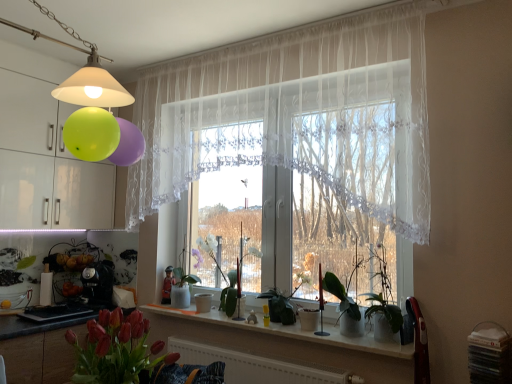
Locate an element on the screen. Image resolution: width=512 pixels, height=384 pixels. white sheer curtain at center is located at coordinates (301, 115).

Describe the element at coordinates (223, 277) in the screenshot. The height and width of the screenshot is (384, 512). I see `white glossy vase at center, acting as the third plant starting from the front` at that location.

The image size is (512, 384). Describe the element at coordinates (384, 305) in the screenshot. I see `green matte plant at center, marked as the 3th plant in a left-to-right arrangement` at that location.

The width and height of the screenshot is (512, 384). I want to click on white sheer curtain at center, so click(x=301, y=115).

Considering the relative positions of matte white lampshade at upper left and green matte plant at center, the 1th plant viewed from the front, in the image provided, is matte white lampshade at upper left in front of green matte plant at center, the 1th plant viewed from the front,?

Yes, it is.

Is matte white lampshade at upper left turned away from green matte plant at center, placed as the 1th plant when sorted from right to left?

matte white lampshade at upper left is not turned away from green matte plant at center, placed as the 1th plant when sorted from right to left.

Between point (92, 101) and point (384, 290), which one is positioned in front?

Positioned in front is point (92, 101).

Is white sheer curtain at center far from white matte radiator at lower center?

Yes, white sheer curtain at center and white matte radiator at lower center are located far from each other.

Is white matte radiator at lower center inside white sheer curtain at center?

Actually, white matte radiator at lower center is outside white sheer curtain at center.

Considering the relative sizes of white sheer curtain at center and white matte radiator at lower center in the image provided, is white sheer curtain at center bigger than white matte radiator at lower center?

Correct, white sheer curtain at center is larger in size than white matte radiator at lower center.

From a real-world perspective, between white sheer curtain at center and white matte radiator at lower center, who is vertically higher?

white sheer curtain at center.

Considering the relative positions of matte white lampshade at upper left and white lace curtain at center in the image provided, is matte white lampshade at upper left behind white lace curtain at center?

No, matte white lampshade at upper left is closer to the camera.

Between matte white lampshade at upper left and white lace curtain at center, which one has larger width?

matte white lampshade at upper left.

From a real-world perspective, is matte white lampshade at upper left under white lace curtain at center?

No, from a real-world perspective, matte white lampshade at upper left is not under white lace curtain at center.

Who is taller, matte white lampshade at upper left or white lace curtain at center?

white lace curtain at center.

How many degrees apart are the facing directions of white matte radiator at lower center and white glossy vase at center, the 1th plant when ordered from left to right?

white matte radiator at lower center and white glossy vase at center, the 1th plant when ordered from left to right, are facing 0.869 degrees away from each other.

Is white matte radiator at lower center bigger than white glossy vase at center, the 1th plant when ordered from left to right?

Actually, white matte radiator at lower center might be smaller than white glossy vase at center, the 1th plant when ordered from left to right.

Would you consider white matte radiator at lower center to be distant from white glossy vase at center, which is counted as the 1th plant, starting from the back?

They are positioned close to each other.

Is white matte radiator at lower center oriented away from white glossy vase at center, which is the 3th plant in right-to-left order?

That's not correct — white matte radiator at lower center is not looking away from white glossy vase at center, which is the 3th plant in right-to-left order.

From a real-world perspective, relative to white lace curtain at center, is white matte radiator at lower center vertically above or below?

white matte radiator at lower center is situated lower than white lace curtain at center in the real world.

Considering the positions of objects white matte radiator at lower center and white lace curtain at center in the image provided, who is in front, white matte radiator at lower center or white lace curtain at center?

white matte radiator at lower center is more forward.

Between white matte radiator at lower center and white lace curtain at center, which one has larger size?

white lace curtain at center.

Is white matte radiator at lower center wider or thinner than white lace curtain at center?

Considering their sizes, white matte radiator at lower center looks slimmer than white lace curtain at center.

This screenshot has height=384, width=512. I want to click on curtain to the left of green matte plant at center, the second plant from the front, so [x=301, y=115].

Which is behind, point (330, 274) or point (285, 113)?

Positioned behind is point (285, 113).

Is green matte plant at center, the second plant positioned from the back, oriented away from white sheer curtain at center?

No, green matte plant at center, the second plant positioned from the back, is not facing away from white sheer curtain at center.

Is green matte plant at center, marked as the 2th plant in a left-to-right arrangement, to the left of white sheer curtain at center from the viewer's perspective?

In fact, green matte plant at center, marked as the 2th plant in a left-to-right arrangement, is to the right of white sheer curtain at center.

Considering the sizes of objects white glossy window sill at center and matte white lampshade at upper left in the image provided, who is taller, white glossy window sill at center or matte white lampshade at upper left?

matte white lampshade at upper left.

In the scene shown: Is white glossy window sill at center wider than matte white lampshade at upper left?

No.

From the image's perspective, does white glossy window sill at center appear higher than matte white lampshade at upper left?

No, from the image's perspective, white glossy window sill at center is not over matte white lampshade at upper left.

Where is `lamp on the left of green matte plant at center, marked as the 3th plant in a left-to-right arrangement`? This screenshot has width=512, height=384. lamp on the left of green matte plant at center, marked as the 3th plant in a left-to-right arrangement is located at coordinates (82, 72).

Locate an element on the screen. The height and width of the screenshot is (384, 512). radiator that appears on the right of white sheer curtain at center is located at coordinates (257, 366).

Based on their spatial positions, is white sheer curtain at center or green matte plant at center, the 2th plant viewed from the right, closer to white glossy window sill at center?

Among the two, green matte plant at center, the 2th plant viewed from the right, is located nearer to white glossy window sill at center.

When comparing their distances from green matte plant at center, marked as the 3th plant in a left-to-right arrangement, does white sheer curtain at center or white matte radiator at lower center seem further?

Based on the image, white sheer curtain at center appears to be further to green matte plant at center, marked as the 3th plant in a left-to-right arrangement.

Based on their spatial positions, is white glossy window sill at center or white glossy vase at center, the 1th plant when ordered from left to right, further from white sheer curtain at center?

white glossy window sill at center lies further to white sheer curtain at center than the other object.

Looking at the image, which one is located further to white glossy vase at center, the 1th plant when ordered from left to right, green matte plant at center, marked as the 3th plant in a left-to-right arrangement, or white matte radiator at lower center?

Among the two, green matte plant at center, marked as the 3th plant in a left-to-right arrangement, is located further to white glossy vase at center, the 1th plant when ordered from left to right.

Estimate the real-world distances between objects in this image. Which object is further from white sheer curtain at center, green matte plant at center, marked as the 2th plant in a left-to-right arrangement, or green matte plant at center, the third plant from the back?

green matte plant at center, marked as the 2th plant in a left-to-right arrangement, is further to white sheer curtain at center.

Estimate the real-world distances between objects in this image. Which object is closer to green matte plant at center, the second plant from the front, white glossy window sill at center or matte white lampshade at upper left?

The object closer to green matte plant at center, the second plant from the front, is white glossy window sill at center.

Which object lies nearer to the anchor point white lace curtain at center, white sheer curtain at center or white glossy vase at center, the 1th plant when ordered from left to right?

white sheer curtain at center.

Estimate the real-world distances between objects in this image. Which object is further from white sheer curtain at center, white matte radiator at lower center or green matte plant at center, the second plant from the front?

white matte radiator at lower center.

Identify the location of curtain between matte white lampshade at upper left and white glossy window sill at center from top to bottom. The image size is (512, 384). (301, 115).

Locate an element on the screen. window frame between matte white lampshade at upper left and green matte plant at center, the second plant positioned from the back, in the vertical direction is located at coordinates (312, 161).

At what (x,y) coordinates should I click in order to perform the action: click on window frame between matte white lampshade at upper left and white glossy vase at center, acting as the third plant starting from the front, along the z-axis. Please return your answer as a coordinate pair (x, y). This screenshot has width=512, height=384. Looking at the image, I should click on (312, 161).

The width and height of the screenshot is (512, 384). I want to click on curtain located between matte white lampshade at upper left and green matte plant at center, placed as the 1th plant when sorted from right to left, in the left-right direction, so (301, 115).